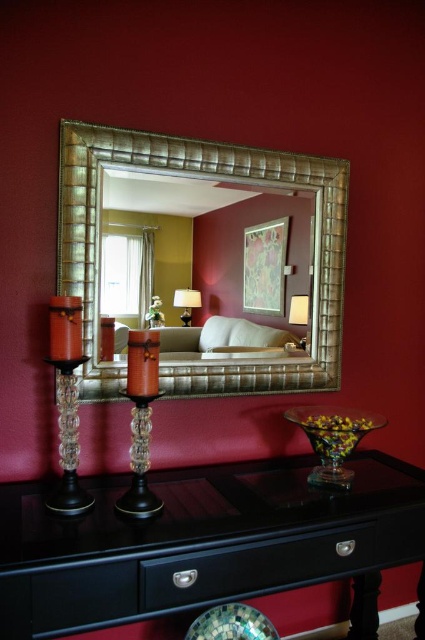
Question: Which point is farther to the camera?

Choices:
 (A) black glossy drawer at lower center
 (B) gold textured mirror at center
 (C) black glossy vanity at lower center
 (D) black wood drawer at lower center

Answer: (B)

Question: Which of the following is the closest to the observer?

Choices:
 (A) black glossy drawer at lower center
 (B) black glossy vanity at lower center

Answer: (B)

Question: Does gold textured mirror at center have a greater width compared to matte gold lampshade at upper right?

Choices:
 (A) yes
 (B) no

Answer: (A)

Question: Which of the following is the farthest from the observer?

Choices:
 (A) matte black lampshade at center
 (B) black wood drawer at lower center

Answer: (A)

Question: Does black glossy vanity at lower center appear over matte black lampshade at center?

Choices:
 (A) yes
 (B) no

Answer: (B)

Question: Is black glossy vanity at lower center below black glossy drawer at lower center?

Choices:
 (A) yes
 (B) no

Answer: (B)